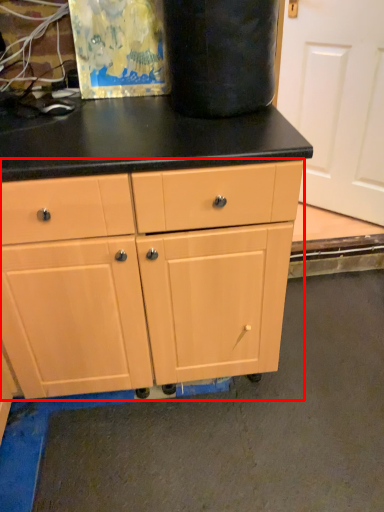
Question: From the image's perspective, considering the relative positions of chest of drawers (annotated by the red box) and screen door in the image provided, where is chest of drawers (annotated by the red box) located with respect to the staircase?

Choices:
 (A) below
 (B) above

Answer: (A)